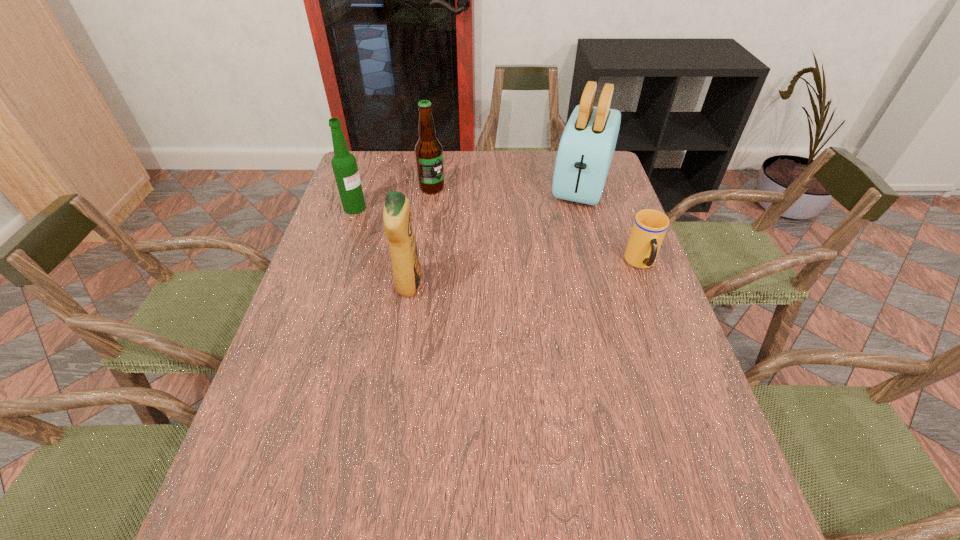
Image resolution: width=960 pixels, height=540 pixels. What are the coordinates of `cup that is at the right edge` in the screenshot? It's located at (649, 228).

You are a GUI agent. You are given a task and a screenshot of the screen. Output one action in this format:
    pyautogui.click(x=<x>, y=<y>)
    Task: Click on the toaster that is positioned at the right edge
    This screenshot has height=540, width=960.
    Given the screenshot: What is the action you would take?
    pyautogui.click(x=587, y=145)

Identify the location of object that is at the far right corner. The image size is (960, 540). (587, 145).

In order to click on free space at the far edge of the desktop in this screenshot , I will do (x=399, y=171).

Find the location of a particular element. Image resolution: width=960 pixels, height=540 pixels. free space at the near edge of the desktop is located at coordinates (555, 466).

I want to click on vacant space at the right edge, so click(650, 341).

What are the coordinates of `vacant space at the far left corner` in the screenshot? It's located at (369, 166).

Image resolution: width=960 pixels, height=540 pixels. Identify the location of vacant space at the near left corner. (x=257, y=458).

In order to click on free space between the right beer bottle and the toaster in this screenshot , I will do `click(507, 185)`.

Where is `empty space between the right beer bottle and the detergent`? empty space between the right beer bottle and the detergent is located at coordinates (420, 237).